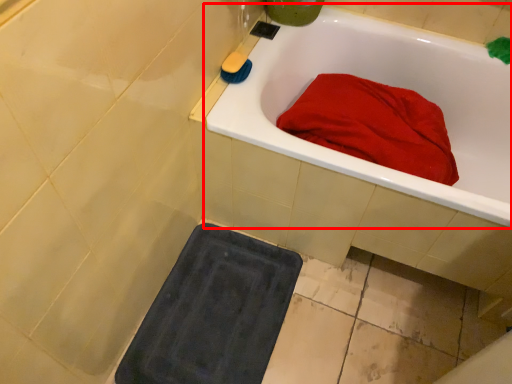
Question: Observing the image, what is the correct spatial positioning of bathtub (annotated by the red box) in reference to soap?

Choices:
 (A) right
 (B) left

Answer: (A)